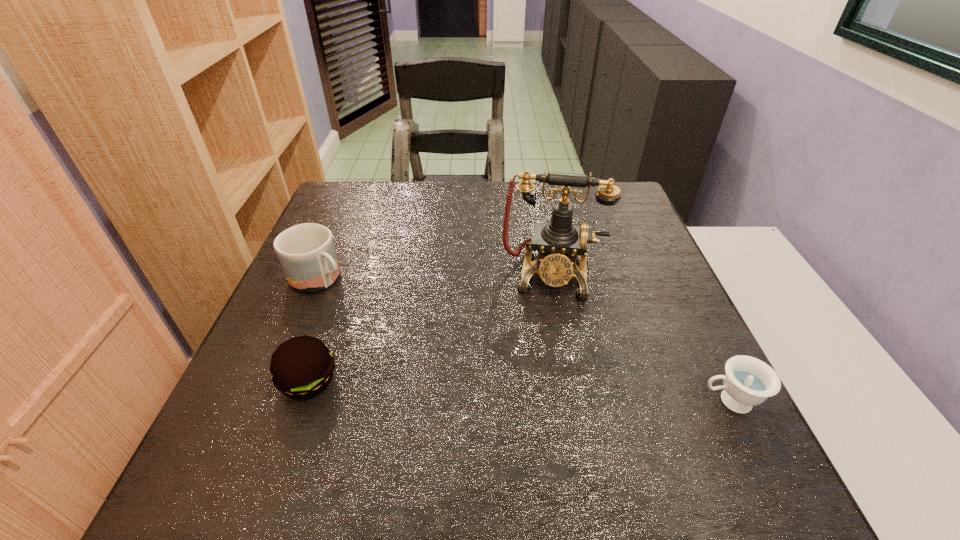
Identify the location of vacant space at the far right corner. The image size is (960, 540). (579, 190).

Where is `free spot between the teacup and the tallest object`? The height and width of the screenshot is (540, 960). free spot between the teacup and the tallest object is located at coordinates (640, 339).

In order to click on vacant area that lies between the teacup and the patty in this screenshot , I will do `click(519, 392)`.

I want to click on vacant area that lies between the rightmost object and the patty, so [x=519, y=392].

Where is `free space that is in between the patty and the third shortest object`? The width and height of the screenshot is (960, 540). free space that is in between the patty and the third shortest object is located at coordinates (315, 330).

I want to click on empty space that is in between the telephone and the patty, so click(431, 328).

Identify the location of free spot between the shortest object and the mug. (524, 340).

Locate an element on the screen. free space between the second tallest object and the rightmost object is located at coordinates (524, 340).

Locate an element on the screen. Image resolution: width=960 pixels, height=540 pixels. free point between the patty and the second object from right to left is located at coordinates (431, 328).

Locate an element on the screen. Image resolution: width=960 pixels, height=540 pixels. vacant area that lies between the shortest object and the third shortest object is located at coordinates (524, 340).